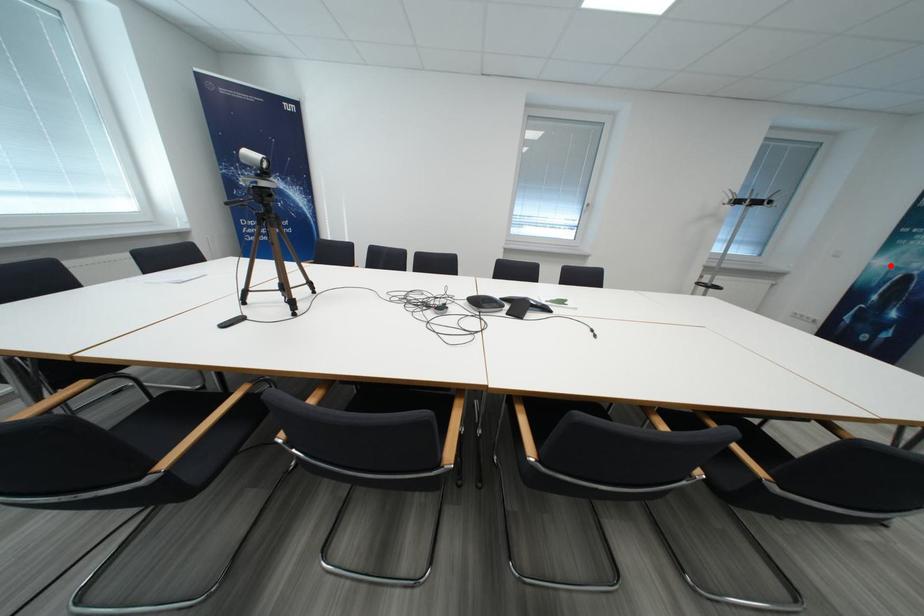
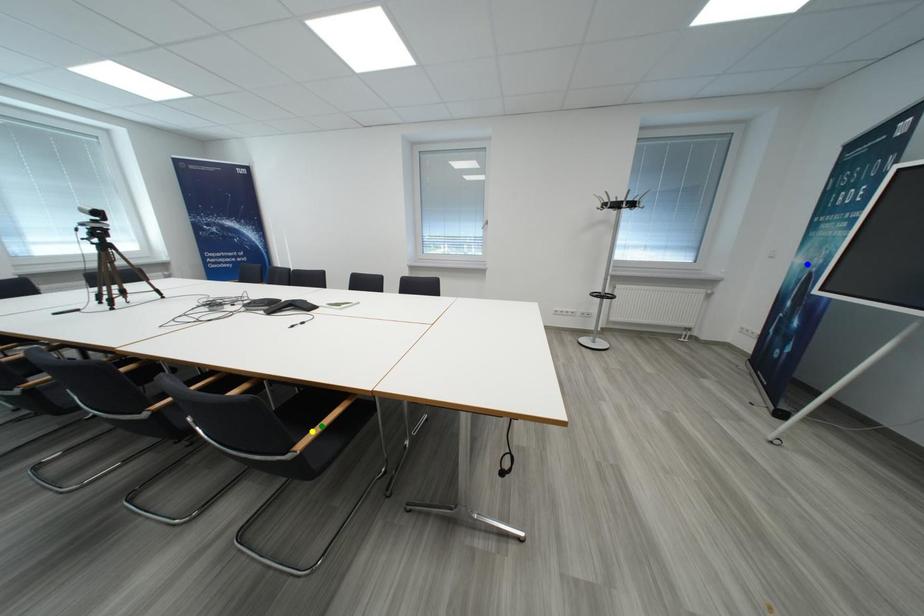
Question: I am providing you with two images of the same scene from different viewpoints. A red point is marked on the first image. You are given multiple points on the second image. Which point in image 2 is actually the same real-world point as the red point in image 1?

Choices:
 (A) blue point
 (B) green point
 (C) yellow point

Answer: (A)